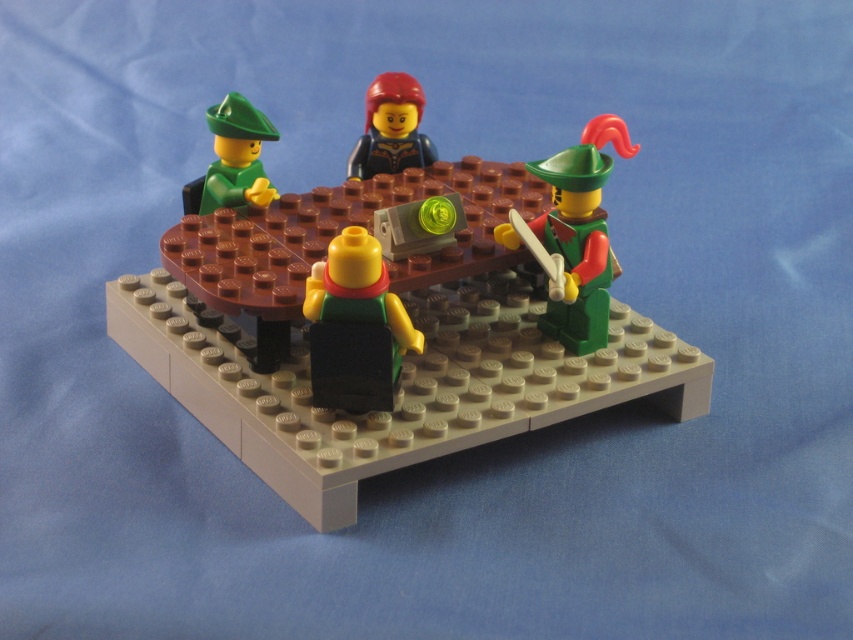
Question: Is brown matte table at center to the right of smooth black minifigure at center from the viewer's perspective?

Choices:
 (A) no
 (B) yes

Answer: (B)

Question: Which point appears farthest from the camera in this image?

Choices:
 (A) pos(489,362)
 (B) pos(624,129)

Answer: (A)

Question: Can you confirm if matte green minifigure at left is positioned below smooth black minifigure at center?

Choices:
 (A) yes
 (B) no

Answer: (A)

Question: Which object is the farthest from the green matte minifigure at right?

Choices:
 (A) brown matte table at center
 (B) matte green minifigure at center
 (C) smooth black minifigure at center

Answer: (B)

Question: Observing the image, what is the correct spatial positioning of matte green minifigure at left in reference to smooth black minifigure at center?

Choices:
 (A) right
 (B) left

Answer: (B)

Question: Which point is closer to the camera?

Choices:
 (A) matte green minifigure at center
 (B) matte green minifigure at left
 (C) brown matte table at center

Answer: (C)